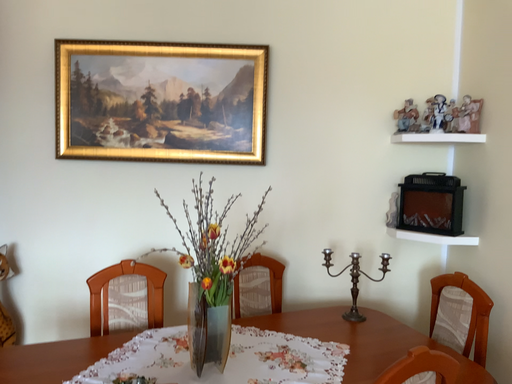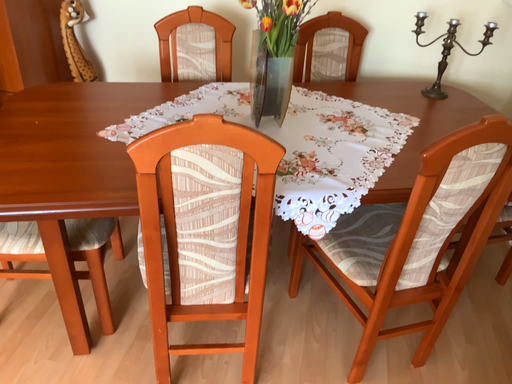
Question: Which way did the camera rotate in the video?

Choices:
 (A) rotated downward
 (B) rotated upward

Answer: (A)